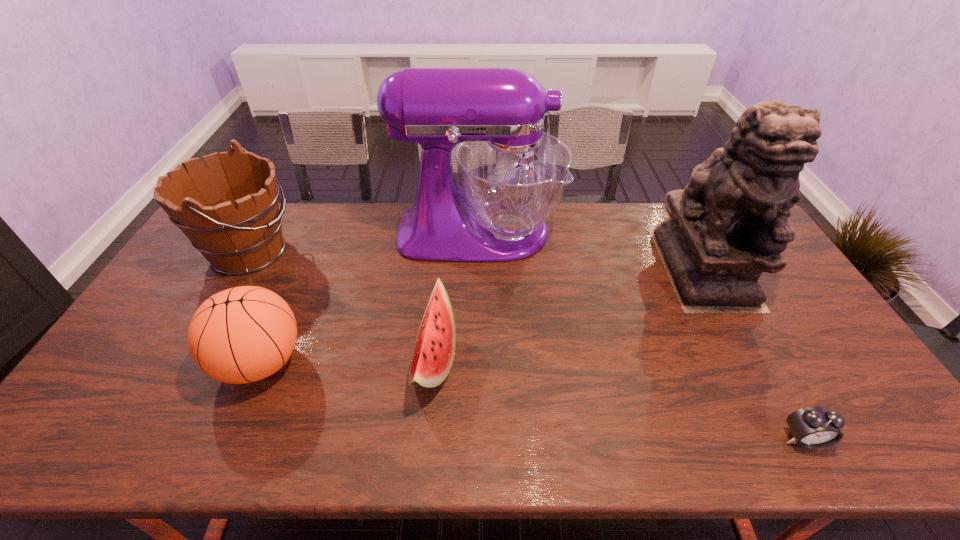
At what (x,y) coordinates should I click in order to perform the action: click on vacant area at the far edge. Please return your answer as a coordinate pair (x, y). This screenshot has height=540, width=960. Looking at the image, I should click on (339, 218).

I want to click on free space at the near edge, so click(631, 429).

In the image, there is a desktop. Where is `vacant area at the left edge`? This screenshot has height=540, width=960. vacant area at the left edge is located at coordinates (172, 305).

Find the location of `vacant space that is in between the third tallest object and the mixer`. vacant space that is in between the third tallest object and the mixer is located at coordinates (364, 242).

What are the coordinates of `free spot between the mixer and the sculpture` in the screenshot? It's located at (590, 249).

Find the location of `free point between the sculpture and the nearest object`. free point between the sculpture and the nearest object is located at coordinates (753, 353).

The height and width of the screenshot is (540, 960). Find the location of `unoccupied position between the mixer and the nearest object`. unoccupied position between the mixer and the nearest object is located at coordinates (641, 335).

You are a GUI agent. You are given a task and a screenshot of the screen. Output one action in this format:
    pyautogui.click(x=<x>, y=<y>)
    Task: Click on the blank region between the mixer and the third tallest object
    The width and height of the screenshot is (960, 540).
    Given the screenshot: What is the action you would take?
    pyautogui.click(x=364, y=242)

Find the location of a particular element. free space between the mixer and the wine bucket is located at coordinates (364, 242).

This screenshot has width=960, height=540. Identify the location of free spot between the mixer and the third tallest object. (364, 242).